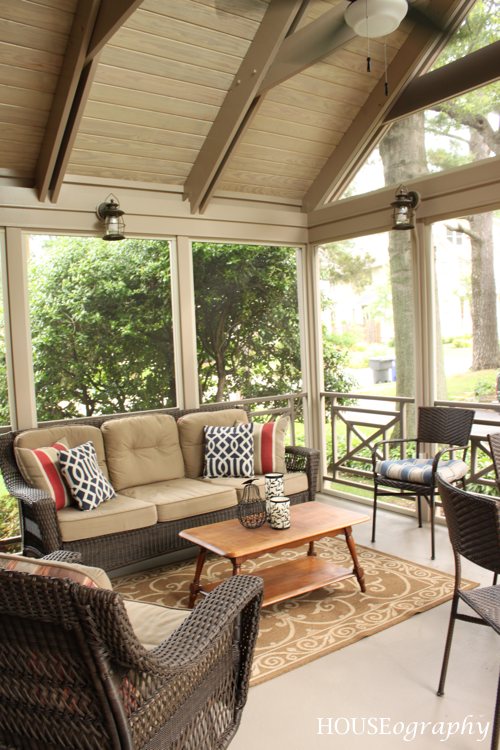
Identify the location of sofa. This screenshot has width=500, height=750. (152, 459).